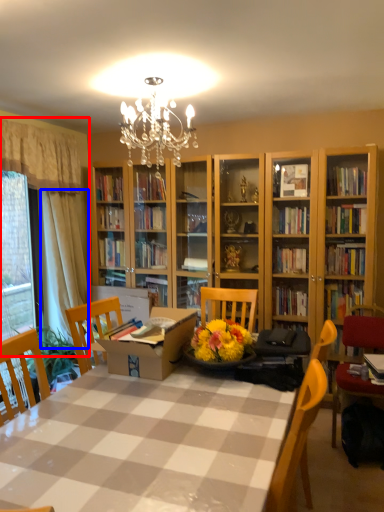
Question: Among these objects, which one is nearest to the camera, curtain (highlighted by a red box) or curtain (highlighted by a blue box)?

Choices:
 (A) curtain
 (B) curtain

Answer: (A)